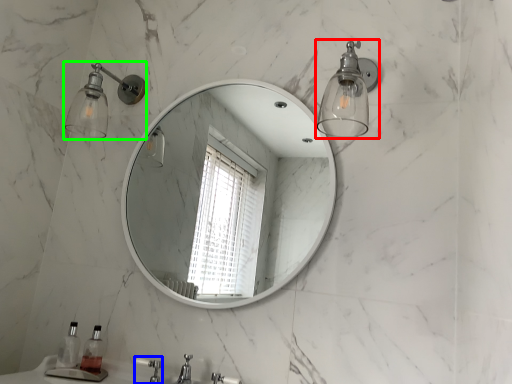
Question: Which is farther away from light fixture (highlighted by a red box)? faucet (highlighted by a blue box) or shower (highlighted by a green box)?

Choices:
 (A) faucet
 (B) shower

Answer: (A)